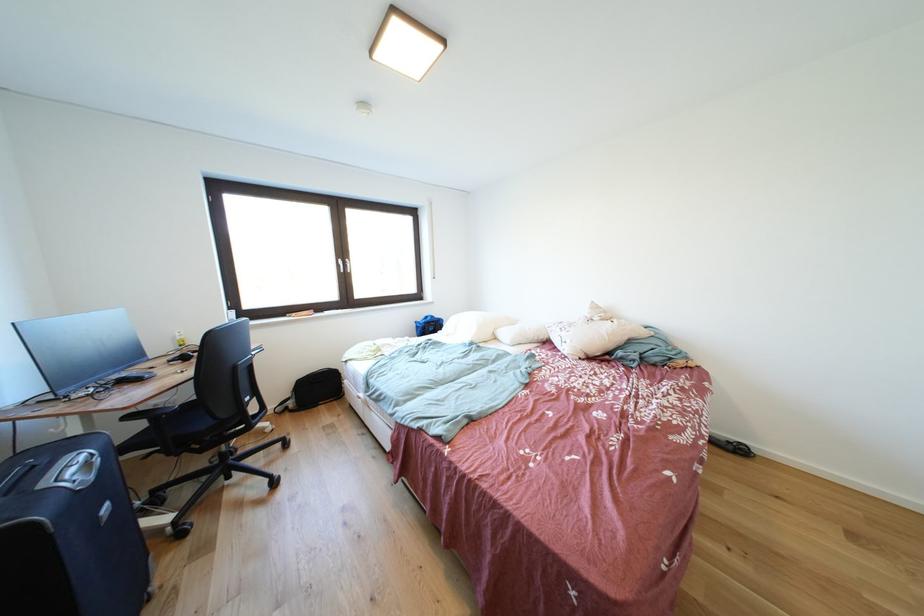
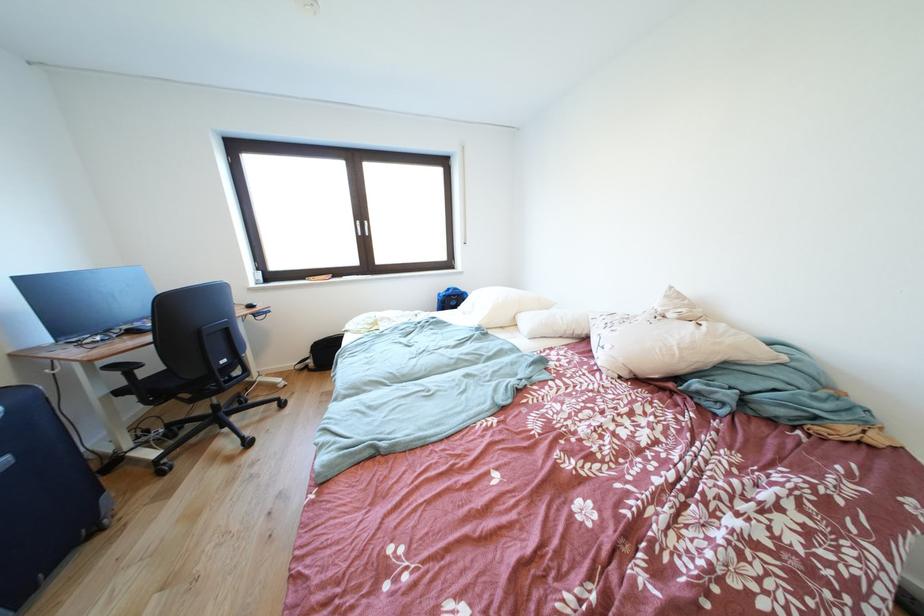
Find the pixel in the second image that matches point 139,422 in the first image.

(120, 371)